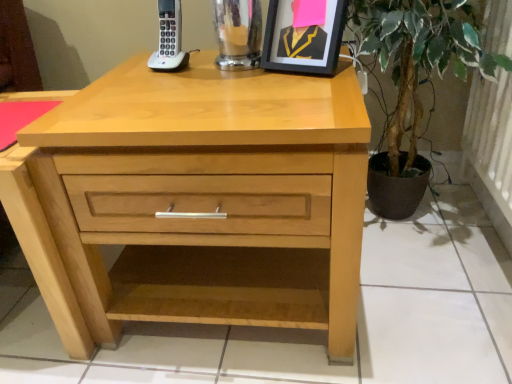
Question: From the image's perspective, is black matte picture frame at upper center below natural wood chest of drawers at center?

Choices:
 (A) yes
 (B) no

Answer: (B)

Question: Considering the relative positions of black matte picture frame at upper center and natural wood chest of drawers at center in the image provided, is black matte picture frame at upper center in front of natural wood chest of drawers at center?

Choices:
 (A) yes
 (B) no

Answer: (B)

Question: Does black matte picture frame at upper center have a greater width compared to natural wood chest of drawers at center?

Choices:
 (A) no
 (B) yes

Answer: (A)

Question: From the image's perspective, is black matte picture frame at upper center on natural wood chest of drawers at center?

Choices:
 (A) no
 (B) yes

Answer: (B)

Question: Is natural wood chest of drawers at center located within black matte picture frame at upper center?

Choices:
 (A) yes
 (B) no

Answer: (B)

Question: In terms of width, does natural wood chest of drawers at center look wider or thinner when compared to green leafy plant at right?

Choices:
 (A) thin
 (B) wide

Answer: (B)

Question: Is natural wood chest of drawers at center in front of or behind green leafy plant at right in the image?

Choices:
 (A) behind
 (B) front

Answer: (B)

Question: In the image, is natural wood chest of drawers at center on the left side or the right side of green leafy plant at right?

Choices:
 (A) right
 (B) left

Answer: (B)

Question: From the image's perspective, is natural wood chest of drawers at center above or below green leafy plant at right?

Choices:
 (A) above
 (B) below

Answer: (B)

Question: Relative to natural wood chest of drawers at center, is green leafy plant at right in front or behind?

Choices:
 (A) behind
 (B) front

Answer: (A)

Question: From a real-world perspective, is green leafy plant at right above or below natural wood chest of drawers at center?

Choices:
 (A) below
 (B) above

Answer: (B)

Question: From the image's perspective, is green leafy plant at right above or below natural wood chest of drawers at center?

Choices:
 (A) above
 (B) below

Answer: (A)

Question: In the image, is green leafy plant at right on the left side or the right side of natural wood chest of drawers at center?

Choices:
 (A) right
 (B) left

Answer: (A)

Question: Is natural wood chest of drawers at center inside the boundaries of black matte picture frame at upper center, or outside?

Choices:
 (A) outside
 (B) inside

Answer: (A)

Question: From a real-world perspective, relative to black matte picture frame at upper center, is natural wood chest of drawers at center vertically above or below?

Choices:
 (A) below
 (B) above

Answer: (A)